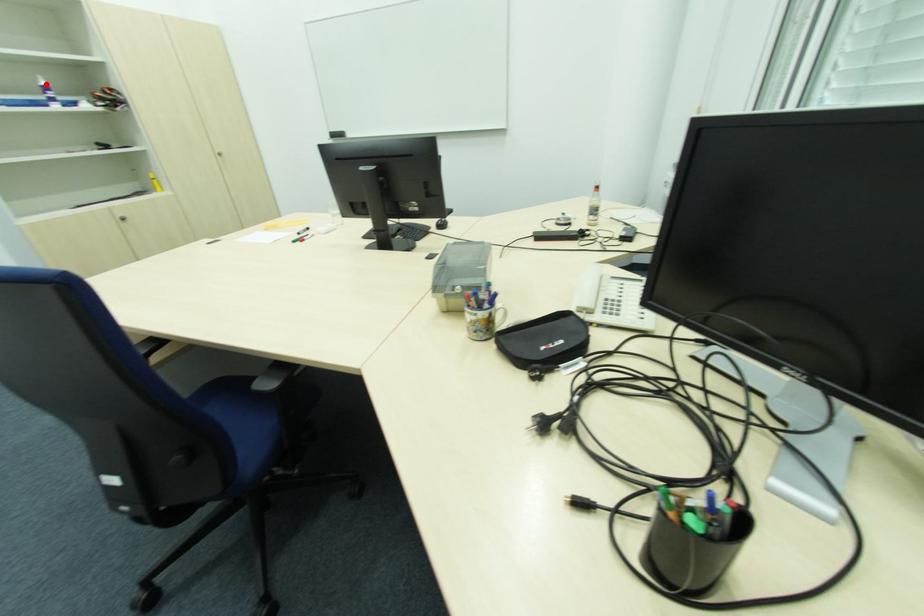
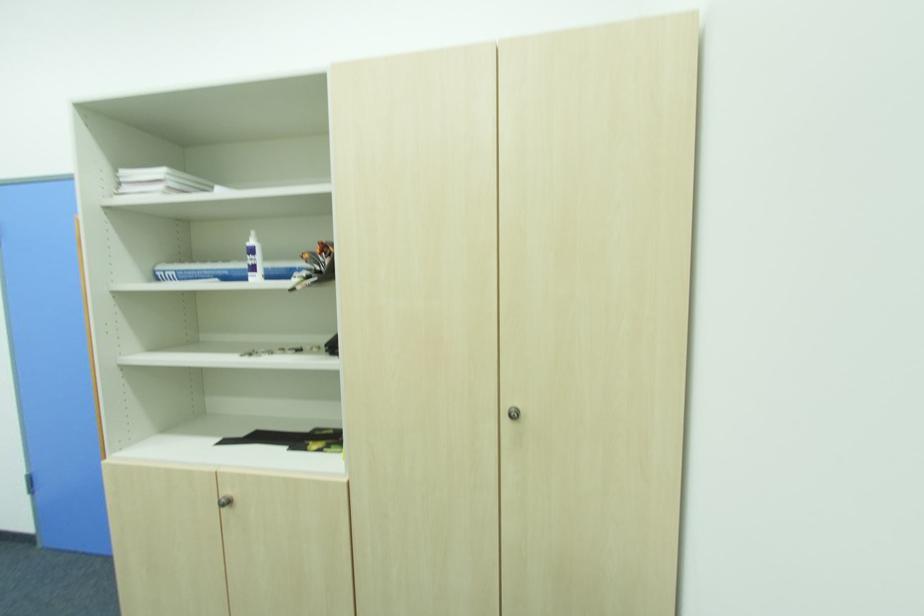
Find the pixel in the second image that matches the highlighted location in the first image.

(254, 243)